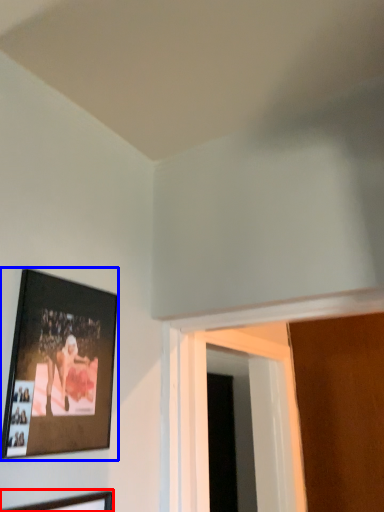
Question: Among these objects, which one is farthest to the camera, picture frame (highlighted by a red box) or picture frame (highlighted by a blue box)?

Choices:
 (A) picture frame
 (B) picture frame

Answer: (B)